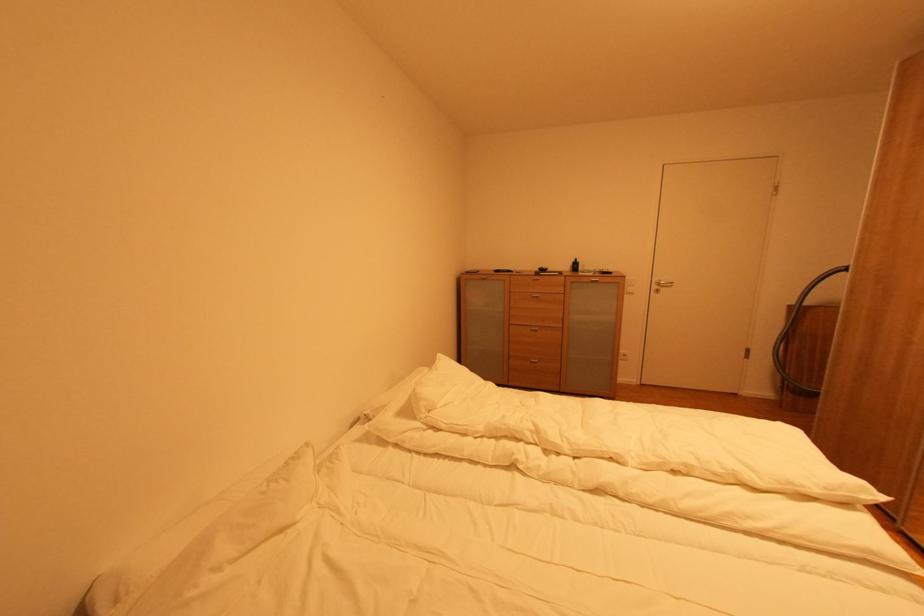
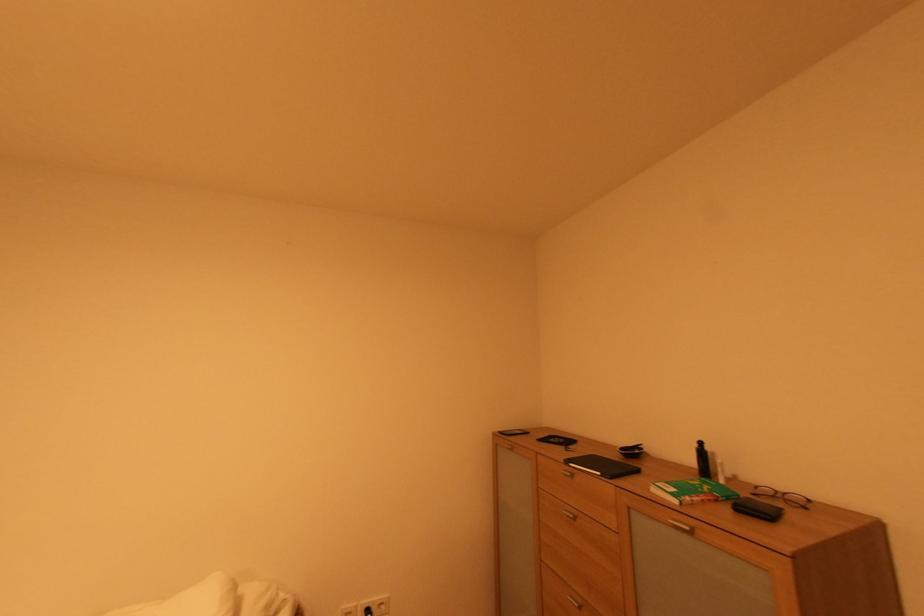
Where in the second image is the point corresponding to point (564, 275) from the first image?

(604, 475)